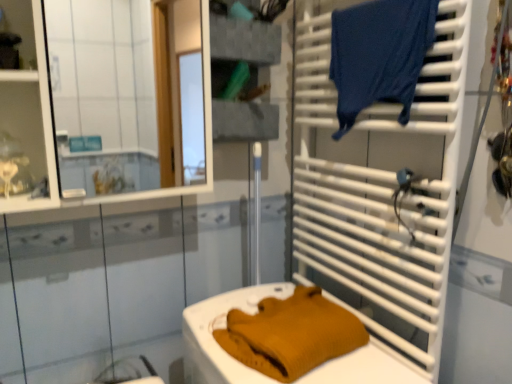
Question: Is dark blue fabric at upper right in contact with mustard knit sweater at lower center?

Choices:
 (A) no
 (B) yes

Answer: (A)

Question: Is dark blue fabric at upper right aimed at mustard knit sweater at lower center?

Choices:
 (A) yes
 (B) no

Answer: (B)

Question: Can mustard knit sweater at lower center be found inside dark blue fabric at upper right?

Choices:
 (A) yes
 (B) no

Answer: (B)

Question: From a real-world perspective, is dark blue fabric at upper right located beneath mustard knit sweater at lower center?

Choices:
 (A) yes
 (B) no

Answer: (B)

Question: Is dark blue fabric at upper right completely or partially outside of mustard knit sweater at lower center?

Choices:
 (A) no
 (B) yes

Answer: (B)

Question: Is white glossy mirror at upper left bigger or smaller than dark blue fabric at upper right?

Choices:
 (A) small
 (B) big

Answer: (B)

Question: Looking at their shapes, would you say white glossy mirror at upper left is wider or thinner than dark blue fabric at upper right?

Choices:
 (A) thin
 (B) wide

Answer: (B)

Question: Is white glossy mirror at upper left taller or shorter than dark blue fabric at upper right?

Choices:
 (A) short
 (B) tall

Answer: (B)

Question: From a real-world perspective, relative to dark blue fabric at upper right, is white glossy mirror at upper left vertically above or below?

Choices:
 (A) above
 (B) below

Answer: (B)

Question: Is point (252, 6) positioned closer to the camera than point (344, 357)?

Choices:
 (A) farther
 (B) closer

Answer: (A)

Question: Looking at their shapes, would you say textured gray fabric at upper center, positioned as the second shelf in front-to-back order, is wider or thinner than mustard knit sweater at lower center?

Choices:
 (A) thin
 (B) wide

Answer: (A)

Question: Considering the relative positions of textured gray fabric at upper center, marked as the 1th shelf in a back-to-front arrangement, and mustard knit sweater at lower center in the image provided, is textured gray fabric at upper center, marked as the 1th shelf in a back-to-front arrangement, to the left or to the right of mustard knit sweater at lower center?

Choices:
 (A) right
 (B) left

Answer: (B)

Question: From the image's perspective, relative to mustard knit sweater at lower center, is textured gray fabric at upper center, positioned as the second shelf in front-to-back order, above or below?

Choices:
 (A) above
 (B) below

Answer: (A)

Question: Based on their positions, is white plastic towel rack at right located to the left or right of matte white shelf at upper left, which is the 1th shelf in front-to-back order?

Choices:
 (A) left
 (B) right

Answer: (B)

Question: Looking at their shapes, would you say white plastic towel rack at right is wider or thinner than matte white shelf at upper left, acting as the second shelf starting from the back?

Choices:
 (A) wide
 (B) thin

Answer: (B)